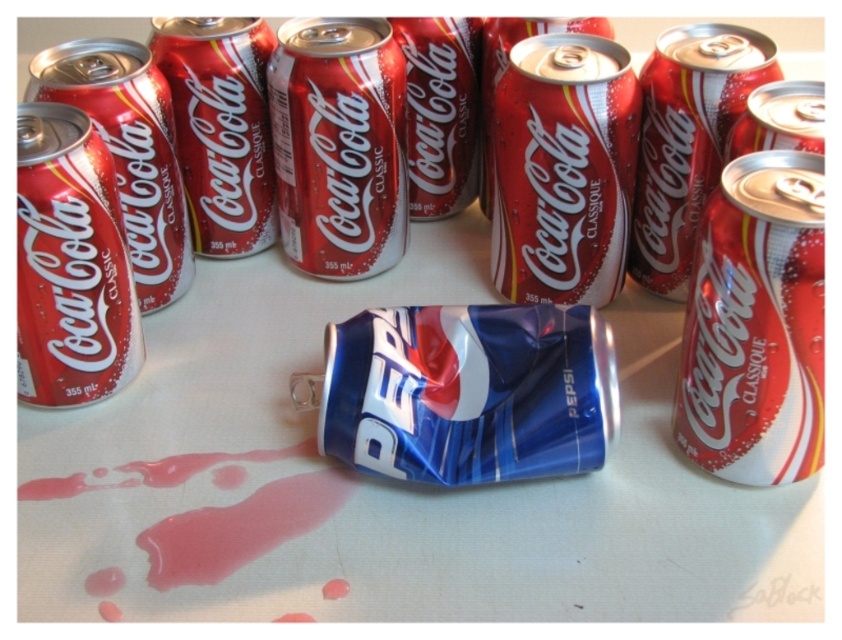
Question: Can you confirm if blue metallic pepsi can at center is positioned below matte red coca-cola can at left?

Choices:
 (A) yes
 (B) no

Answer: (A)

Question: Among these objects, which one is nearest to the camera?

Choices:
 (A) shiny metallic can at center
 (B) glossy aluminum can at upper right
 (C) matte red coca-cola can at left

Answer: (C)

Question: Is shiny metallic can at upper right behind glossy aluminum can at upper right?

Choices:
 (A) yes
 (B) no

Answer: (B)

Question: Which object is positioned closest to the glossy aluminum can at upper right?

Choices:
 (A) shiny metallic can at center
 (B) blue metallic pepsi can at center
 (C) matte red coca-cola can at left
 (D) shiny metallic can at upper right

Answer: (B)

Question: Where is matte red coca-cola can at left located in relation to glossy aluminum can at upper right in the image?

Choices:
 (A) right
 (B) left

Answer: (B)

Question: Which object is closer to the camera taking this photo?

Choices:
 (A) blue metallic pepsi can at center
 (B) shiny metallic can at center
 (C) matte red coca-cola can at left

Answer: (A)